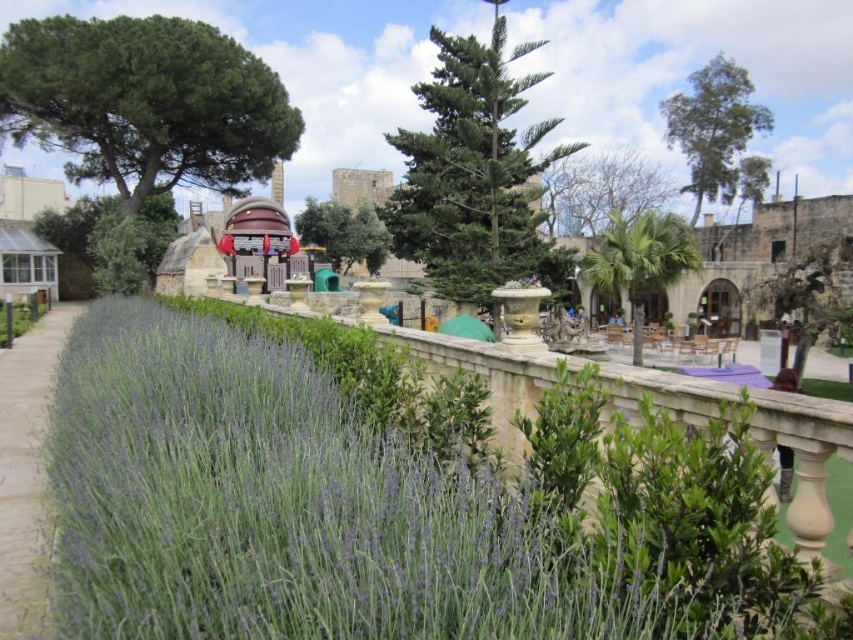
You are standing in the garden and want to walk from the starting point to the destination point. The starting point is at point [691,81] and the destination is at point [610,170]. Will you have to go around any obstacles between these two points?

Point [691,81] is behind point [610,170], so you will not have to go around any obstacles between these two points.

You are a gardener who needs to water the green leafy lavender at lower left and the green grass at lower left. Your watering can holds enough water to cover 5 meters. Can you water both without refilling?

The distance between the green leafy lavender at lower left and the green grass at lower left is 7.35 meters, which exceeds the 5 meter capacity of the watering can. Therefore, you cannot water both areas without refilling.